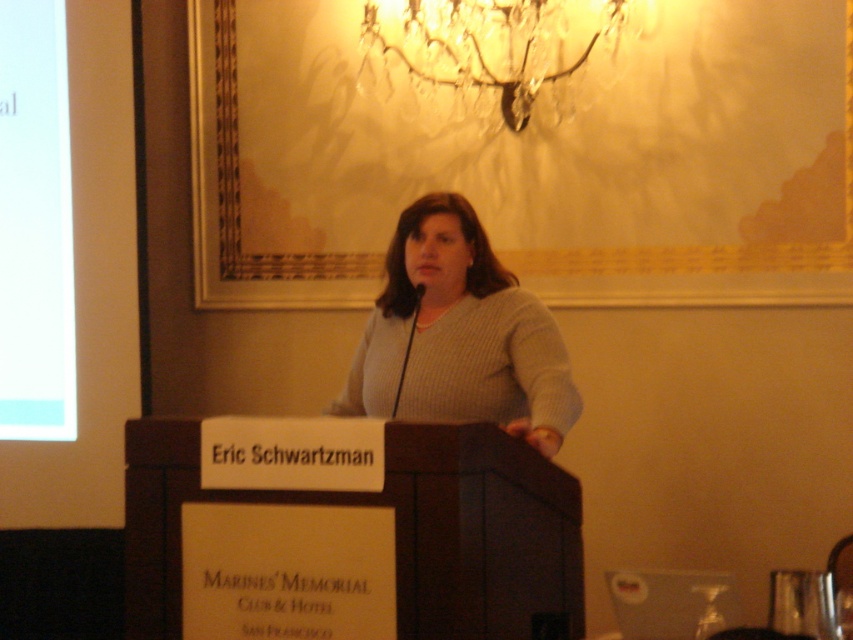
Is gray knitted sweater at center positioned behind crystal glass chandelier at upper center?

No, it is not.

Does point (430, 340) come closer to viewer compared to point (415, 49)?

Yes.

Identify the location of gray knitted sweater at center. (459, 336).